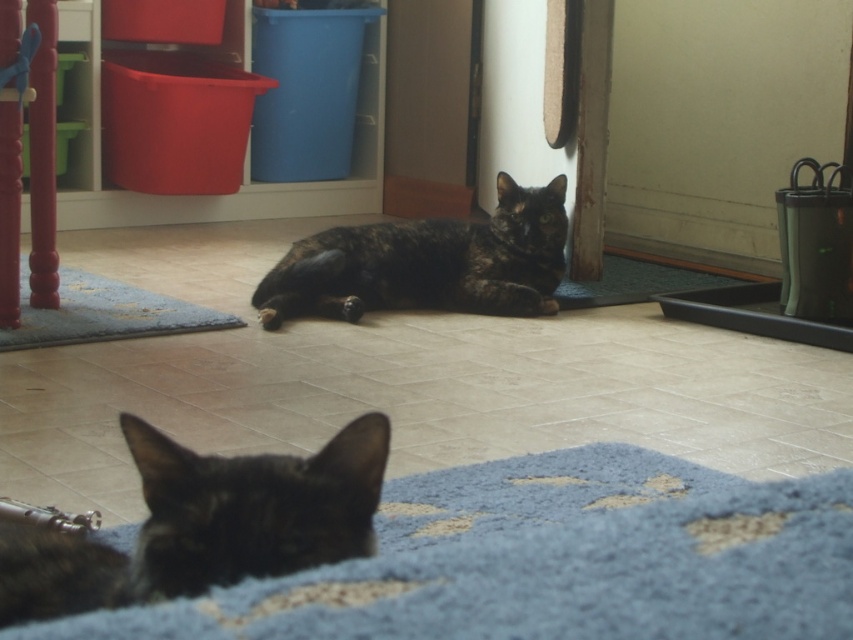
You are standing in the room and want to pick up an object. There are two points marked in the image. Which point, point (113, 579) or point (317, 307), is closer to you?

Point (113, 579) is closer to the camera than point (317, 307), so the point closer to you is point (113, 579).

You are a cat owner who wants to place a new cat bed on the floor. You have a cat bed that is 30 cm tall. Can you place it on the blue shaggy mat at lower center without blocking the view of the tortoiseshell fur cat at center?

The blue shaggy mat at lower center is not as tall as the tortoiseshell fur cat at center. Since the cat bed is 30 cm tall and the mat is shorter than the cat, placing the bed on the mat would not block the view of the tortoiseshell fur cat at center.